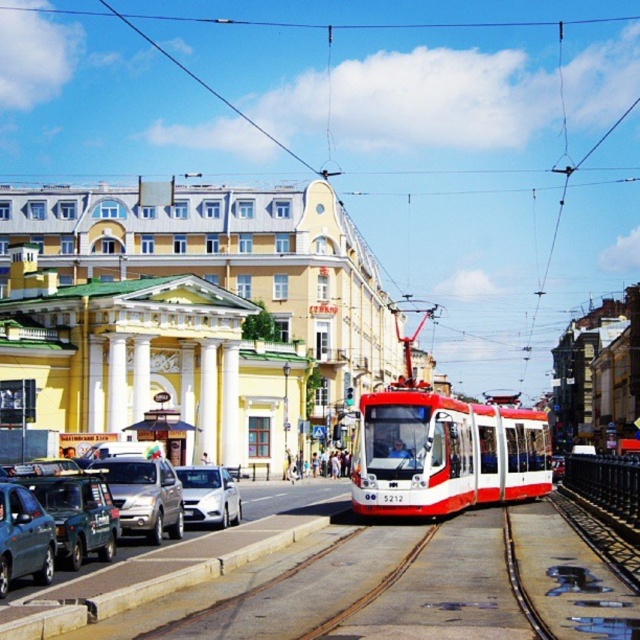
Who is higher up, silver metallic suv at center-left or white glossy sedan at center?

silver metallic suv at center-left

Describe the element at coordinates (145, 496) in the screenshot. Image resolution: width=640 pixels, height=640 pixels. I see `silver metallic suv at center-left` at that location.

Between point (140, 502) and point (198, 493), which one is positioned in front?

Point (140, 502) is more forward.

Where is `silver metallic suv at center-left`? silver metallic suv at center-left is located at coordinates (145, 496).

Is metallic silver car at left thinner than white glossy sedan at center?

Correct, metallic silver car at left's width is less than white glossy sedan at center's.

Image resolution: width=640 pixels, height=640 pixels. What do you see at coordinates (22, 538) in the screenshot?
I see `metallic silver car at left` at bounding box center [22, 538].

What do you see at coordinates (22, 538) in the screenshot? I see `metallic silver car at left` at bounding box center [22, 538].

The width and height of the screenshot is (640, 640). Find the location of `metallic silver car at left`. metallic silver car at left is located at coordinates (22, 538).

Between red/white polished tram at center and white glossy sedan at center, which one appears on the right side from the viewer's perspective?

red/white polished tram at center is more to the right.

Which is in front, point (538, 483) or point (209, 508)?

Positioned in front is point (209, 508).

The height and width of the screenshot is (640, 640). I want to click on red/white polished tram at center, so click(444, 452).